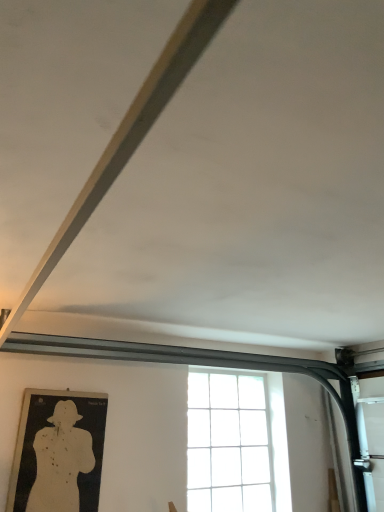
Question: From the image's perspective, relative to clear glass window at center, is white paper target at lower left above or below?

Choices:
 (A) below
 (B) above

Answer: (B)

Question: From a real-world perspective, relative to clear glass window at center, is white paper target at lower left vertically above or below?

Choices:
 (A) below
 (B) above

Answer: (A)

Question: Visually, is white paper target at lower left positioned to the left or to the right of clear glass window at center?

Choices:
 (A) right
 (B) left

Answer: (B)

Question: From the image's perspective, is clear glass window at center positioned above or below white paper target at lower left?

Choices:
 (A) below
 (B) above

Answer: (A)

Question: Would you say clear glass window at center is to the left or to the right of white paper target at lower left in the picture?

Choices:
 (A) left
 (B) right

Answer: (B)

Question: Considering the positions of clear glass window at center and white paper target at lower left in the image, is clear glass window at center wider or thinner than white paper target at lower left?

Choices:
 (A) wide
 (B) thin

Answer: (A)

Question: Is point (268, 425) positioned closer to the camera than point (44, 488)?

Choices:
 (A) closer
 (B) farther

Answer: (B)